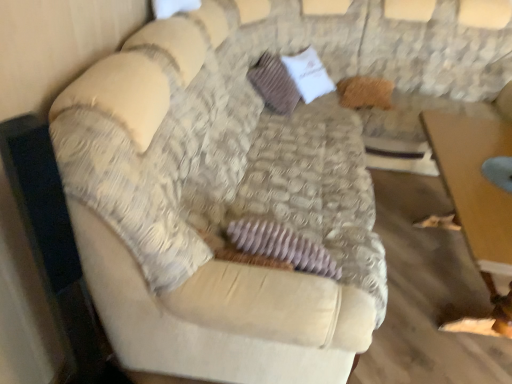
Question: Does velvet beige couch at center touch brown textured pillow at center?

Choices:
 (A) no
 (B) yes

Answer: (A)

Question: Would you say velvet beige couch at center is a long distance from brown textured pillow at center?

Choices:
 (A) yes
 (B) no

Answer: (B)

Question: Is the depth of velvet beige couch at center less than that of brown textured pillow at center?

Choices:
 (A) no
 (B) yes

Answer: (B)

Question: From a real-world perspective, does velvet beige couch at center sit lower than brown textured pillow at center?

Choices:
 (A) no
 (B) yes

Answer: (A)

Question: From a real-world perspective, is velvet beige couch at center positioned over brown textured pillow at center based on gravity?

Choices:
 (A) no
 (B) yes

Answer: (B)

Question: Would you say velvet beige couch at center is outside brown textured pillow at center?

Choices:
 (A) yes
 (B) no

Answer: (A)

Question: Is brown textured pillow at center at the back of wooden table at lower right?

Choices:
 (A) no
 (B) yes

Answer: (B)

Question: Is wooden table at lower right further to camera compared to brown textured pillow at center?

Choices:
 (A) yes
 (B) no

Answer: (B)

Question: Is wooden table at lower right far away from brown textured pillow at center?

Choices:
 (A) no
 (B) yes

Answer: (B)

Question: From a real-world perspective, is wooden table at lower right located beneath brown textured pillow at center?

Choices:
 (A) no
 (B) yes

Answer: (B)

Question: Does wooden table at lower right turn towards brown textured pillow at center?

Choices:
 (A) yes
 (B) no

Answer: (B)

Question: Is wooden table at lower right closer to the viewer compared to brown textured pillow at center?

Choices:
 (A) no
 (B) yes

Answer: (B)

Question: Is brown textured pillow at center positioned with its back to velvet beige couch at center?

Choices:
 (A) no
 (B) yes

Answer: (A)